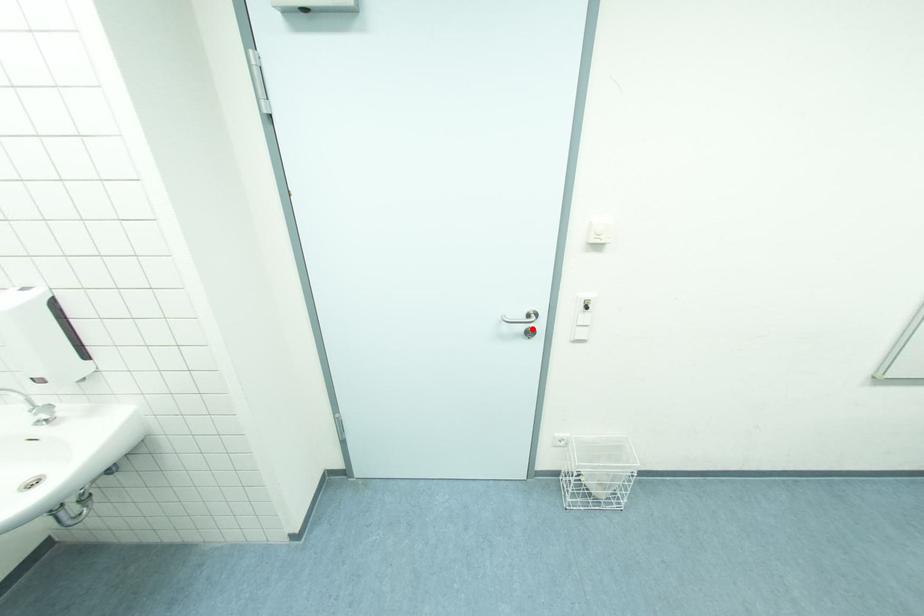
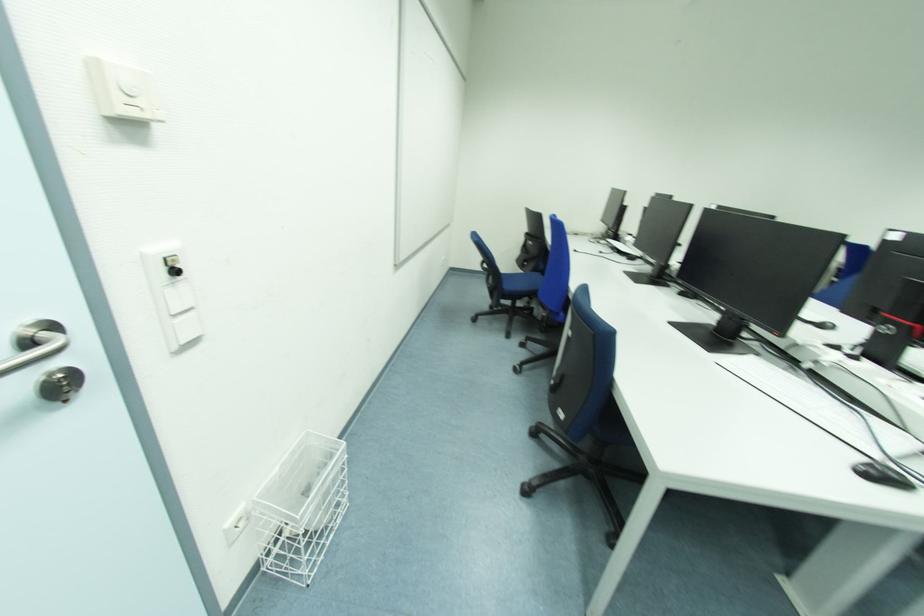
Where in the second image is the point corresponding to the highlighted location from the first image?

(55, 375)